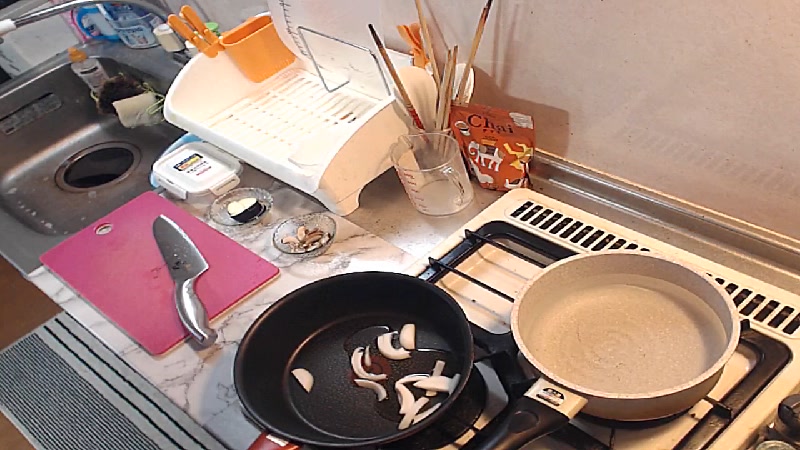
Where is `cutting board`? cutting board is located at coordinates (130, 266).